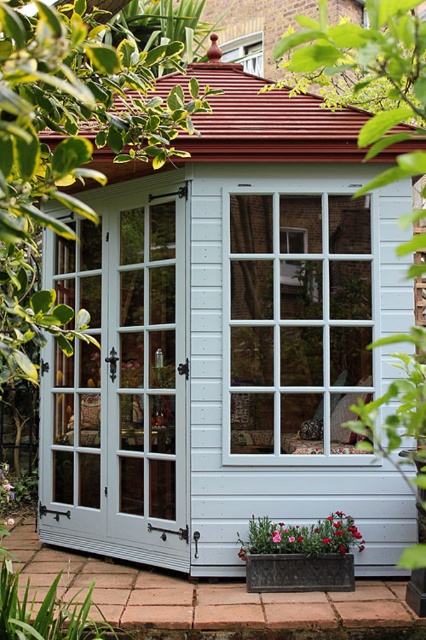
Does white wooden bay window at center have a smaller size compared to pink fabric flower at lower center?

No.

Is point (275, 204) positioned before point (356, 545)?

No.

Find the location of a particular element. The width and height of the screenshot is (426, 640). white wooden bay window at center is located at coordinates (298, 321).

Can you confirm if pink fabric flower at lower center is bigger than matte white window at upper center?

Actually, pink fabric flower at lower center might be smaller than matte white window at upper center.

Is point (328, 529) positioned before point (253, 49)?

Yes, it is in front of point (253, 49).

Identify the location of pink fabric flower at lower center. (302, 536).

The width and height of the screenshot is (426, 640). I want to click on pink fabric flower at lower center, so click(302, 536).

What do you see at coordinates (118, 381) in the screenshot? This screenshot has width=426, height=640. I see `white glass door at center` at bounding box center [118, 381].

Who is lower down, white glass door at center or white wooden bay window at center?

white glass door at center

Is point (172, 444) positioned after point (353, 291)?

Yes, point (172, 444) is farther from viewer.

Locate an element on the screen. white glass door at center is located at coordinates (118, 381).